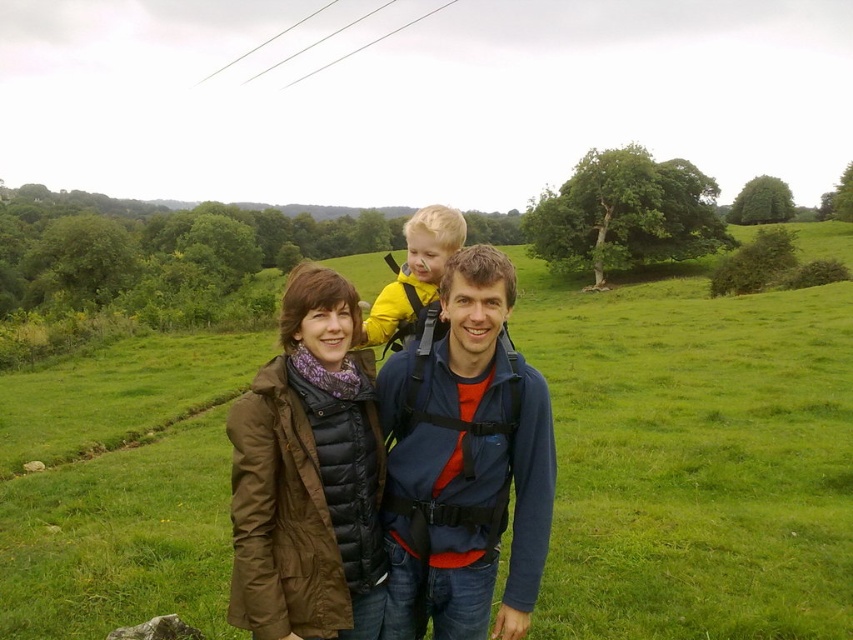
Question: Among these objects, which one is nearest to the camera?

Choices:
 (A) brown quilted jacket at center
 (B) yellow fabric baby carrier at center
 (C) green grassy field at center

Answer: (A)

Question: Which point appears closest to the camera in this image?

Choices:
 (A) (637, 314)
 (B) (526, 449)
 (C) (245, 547)
 (D) (433, 205)

Answer: (C)

Question: Does blue fabric backpack at center lie in front of yellow fabric baby carrier at center?

Choices:
 (A) no
 (B) yes

Answer: (B)

Question: Which object is closer to the camera taking this photo?

Choices:
 (A) green grassy field at center
 (B) yellow fabric baby carrier at center
 (C) blue fabric backpack at center

Answer: (C)

Question: Does blue fabric backpack at center have a larger size compared to brown quilted jacket at center?

Choices:
 (A) yes
 (B) no

Answer: (A)

Question: Is brown quilted jacket at center positioned at the back of yellow fabric baby carrier at center?

Choices:
 (A) yes
 (B) no

Answer: (B)